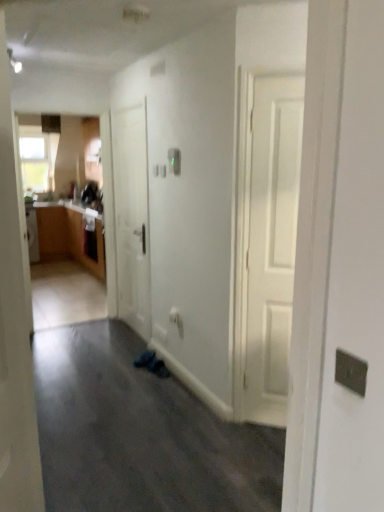
Question: From a real-world perspective, relative to white matte door at center, the 2th door positioned from the right, is dark gray carpet at lower center vertically above or below?

Choices:
 (A) above
 (B) below

Answer: (B)

Question: In terms of height, does dark gray carpet at lower center look taller or shorter compared to white matte door at center, acting as the 1th door starting from the back?

Choices:
 (A) short
 (B) tall

Answer: (A)

Question: Considering the real-world distances, which object is farthest from the clear glass window at upper left?

Choices:
 (A) white matte door at center, the 2th door positioned from the right
 (B) white matte door at left, the 2th door from the back
 (C) dark gray carpet at lower center

Answer: (B)

Question: Estimate the real-world distances between objects in this image. Which object is closer to the white matte door at left, which appears as the second door when viewed from the left?

Choices:
 (A) dark gray carpet at lower center
 (B) clear glass window at upper left
 (C) white matte door at center, the 2th door in the front-to-back sequence

Answer: (A)